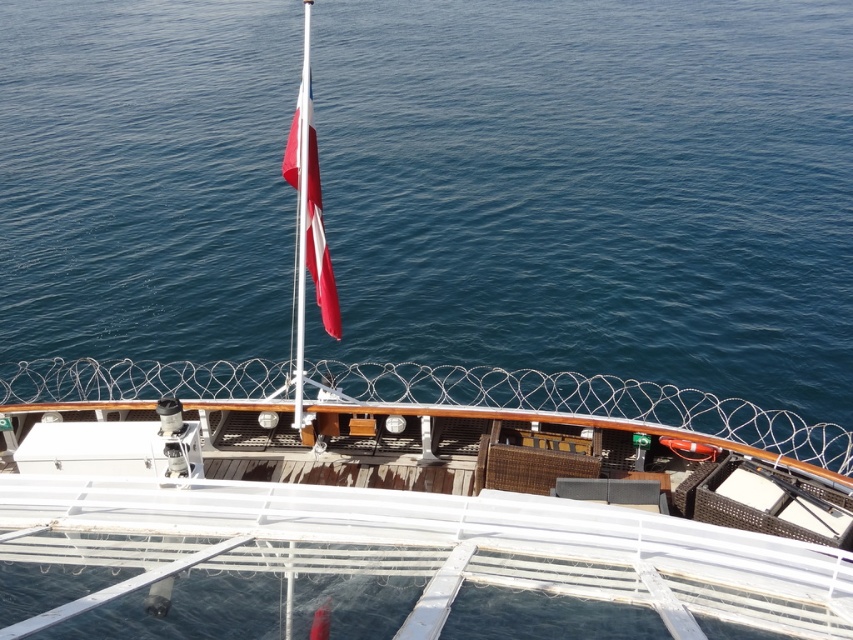
Question: Where is blue water at center located in relation to red fabric flag at center in the image?

Choices:
 (A) right
 (B) left

Answer: (A)

Question: Which point is farther from the camera taking this photo?

Choices:
 (A) (175, 38)
 (B) (316, 208)

Answer: (A)

Question: Does blue water at center have a lesser width compared to red fabric flag at center?

Choices:
 (A) yes
 (B) no

Answer: (B)

Question: Can you confirm if blue water at center is wider than red fabric flag at center?

Choices:
 (A) yes
 (B) no

Answer: (A)